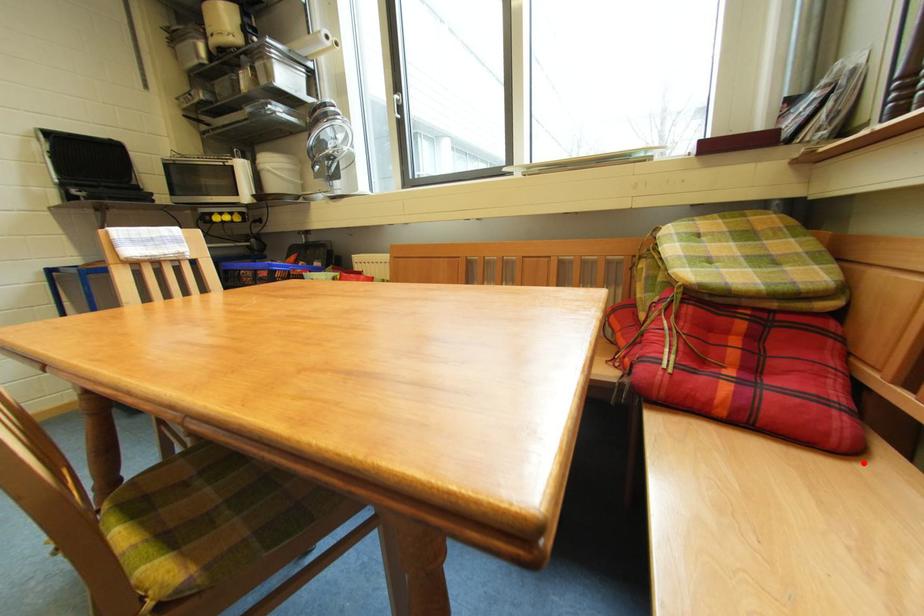
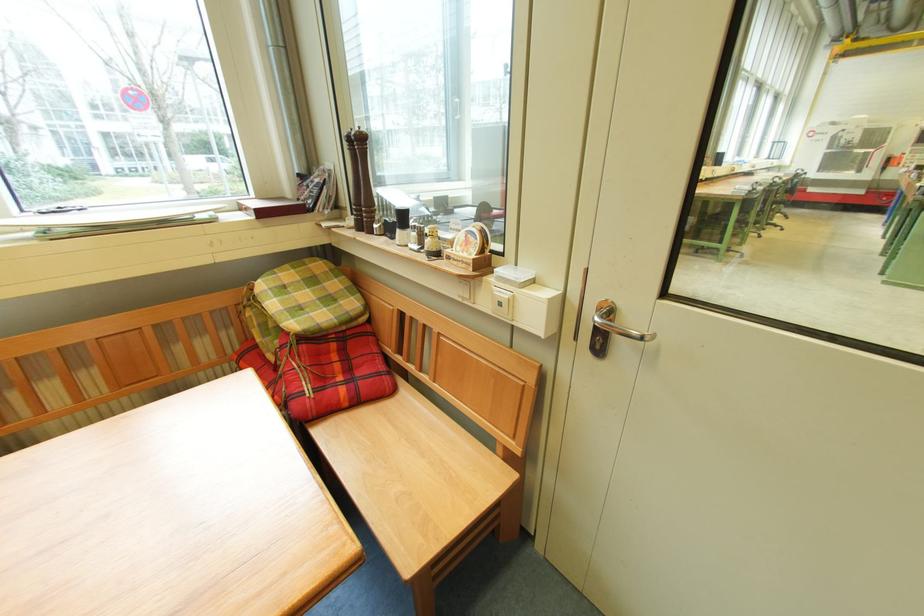
Question: I am providing you with two images of the same scene from different viewpoints. A red point is shown in image1. For the corresponding object point in image2, is it positioned nearer or farther from the camera?

Choices:
 (A) Nearer
 (B) Farther

Answer: (A)